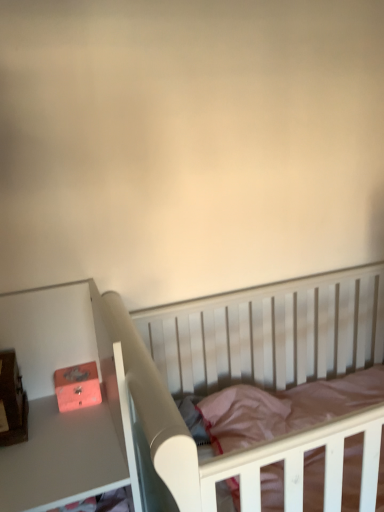
The width and height of the screenshot is (384, 512). I want to click on matte orange box at left, so click(x=77, y=386).

What do you see at coordinates (77, 386) in the screenshot? I see `matte orange box at left` at bounding box center [77, 386].

Where is `matte pink drawer at left`? matte pink drawer at left is located at coordinates (57, 404).

Which object is further away from the camera, white wood crib at center or matte orange box at left?

matte orange box at left.

Is white wood crib at center next to matte orange box at left and touching it?

No.

Is point (357, 298) less distant than point (64, 382)?

No, it is not.

How different are the orientations of matte pink drawer at left and matte orange box at left in degrees?

1.64 degrees.

In the scene shown: Are matte pink drawer at left and matte orange box at left far apart?

No, matte pink drawer at left is not far from matte orange box at left.

Which object is thinner, matte pink drawer at left or matte orange box at left?

Thinner between the two is matte orange box at left.

Considering the relative positions of matte pink drawer at left and matte orange box at left in the image provided, is matte pink drawer at left to the left of matte orange box at left from the viewer's perspective?

Yes, matte pink drawer at left is to the left of matte orange box at left.

From the image's perspective, who appears lower, matte orange box at left or matte pink drawer at left?

matte pink drawer at left is shown below in the image.

Consider the image. Is matte orange box at left looking in the opposite direction of matte pink drawer at left?

Yes.

Is matte orange box at left inside or outside of matte pink drawer at left?

matte orange box at left is inside matte pink drawer at left.

Is matte orange box at left touching matte pink drawer at left?

No, matte orange box at left is not touching matte pink drawer at left.

Considering the positions of objects matte pink drawer at left and white wood crib at center in the image provided, who is more to the right, matte pink drawer at left or white wood crib at center?

white wood crib at center.

Between point (68, 349) and point (292, 288), which one is positioned behind?

Positioned behind is point (292, 288).

Is matte pink drawer at left positioned behind white wood crib at center?

Yes.

From a real-world perspective, does matte pink drawer at left sit lower than white wood crib at center?

Actually, matte pink drawer at left is physically above white wood crib at center in the real world.

Considering the positions of objects matte orange box at left and white wood crib at center in the image provided, who is more to the left, matte orange box at left or white wood crib at center?

From the viewer's perspective, matte orange box at left appears more on the left side.

You are a GUI agent. You are given a task and a screenshot of the screen. Output one action in this format:
    pyautogui.click(x=<x>, y=<y>)
    Task: Click on the infant bed that appears on the right of matte orange box at left
    This screenshot has height=512, width=384.
    Given the screenshot: What is the action you would take?
    pyautogui.click(x=246, y=373)

Can you tell me how much matte orange box at left and white wood crib at center differ in facing direction?

The angle between the facing direction of matte orange box at left and the facing direction of white wood crib at center is 1.09 degrees.

Considering the sizes of objects matte orange box at left and white wood crib at center in the image provided, who is smaller, matte orange box at left or white wood crib at center?

matte orange box at left is smaller.

From a real-world perspective, is white wood crib at center positioned under matte pink drawer at left based on gravity?

Yes.

This screenshot has height=512, width=384. In order to click on infant bed that appears on the right of matte pink drawer at left in this screenshot , I will do `click(246, 373)`.

Considering the relative positions of white wood crib at center and matte pink drawer at left in the image provided, is white wood crib at center behind matte pink drawer at left?

No, it is in front of matte pink drawer at left.

Can you confirm if white wood crib at center is taller than matte pink drawer at left?

Indeed, white wood crib at center has a greater height compared to matte pink drawer at left.

You are a GUI agent. You are given a task and a screenshot of the screen. Output one action in this format:
    pyautogui.click(x=<x>, y=<y>)
    Task: Click on the infant bed below the matte orange box at left (from a real-world perspective)
    The image size is (384, 512).
    Given the screenshot: What is the action you would take?
    tap(246, 373)

Where is `box on the right of the matte pink drawer at left`? Image resolution: width=384 pixels, height=512 pixels. box on the right of the matte pink drawer at left is located at coordinates (77, 386).

When comparing their distances from matte pink drawer at left, does white wood crib at center or matte orange box at left seem further?

white wood crib at center.

Which object lies nearer to the anchor point white wood crib at center, matte pink drawer at left or matte orange box at left?

matte pink drawer at left is positioned closer to the anchor white wood crib at center.

Looking at this image, based on their spatial positions, is matte pink drawer at left or white wood crib at center further from matte orange box at left?

Based on the image, white wood crib at center appears to be further to matte orange box at left.

Based on the photo, from the image, which object appears to be nearer to matte orange box at left, white wood crib at center or matte pink drawer at left?

matte pink drawer at left is closer to matte orange box at left.

Consider the image. Considering their positions, is matte orange box at left positioned further to matte pink drawer at left than white wood crib at center?

white wood crib at center.

Estimate the real-world distances between objects in this image. Which object is further from white wood crib at center, matte orange box at left or matte pink drawer at left?

Among the two, matte orange box at left is located further to white wood crib at center.

The height and width of the screenshot is (512, 384). I want to click on box located between matte pink drawer at left and white wood crib at center in the left-right direction, so click(x=77, y=386).